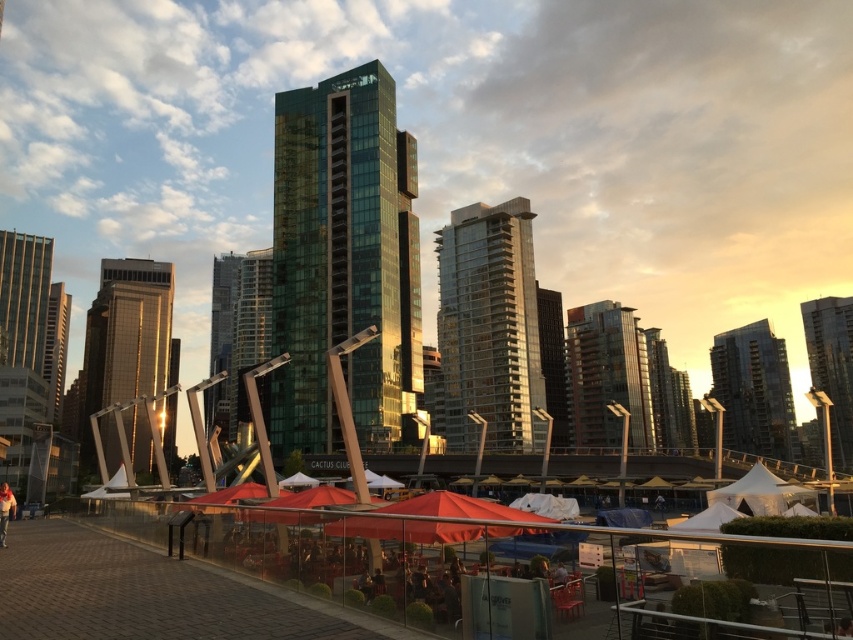
You are an architect evaluating the urban layout. You notice the brown glass building at center and the glassy reflective skyscraper at center. Which structure would cast a longer shadow during the late afternoon sun depicted in the scene?

The glassy reflective skyscraper at center is taller than the brown glass building at center, so it would cast a longer shadow during the late afternoon sun depicted in the scene.

You are standing at the plaza and want to take a photo of the brown glass building at center and the glassy reflective skyscraper at center. Which one should you focus on first if you want to capture both in a single frame without moving the camera?

You should focus on the brown glass building at center first because it is closer to you than the glassy reflective skyscraper at center, so it will be in focus while adjusting the depth of field to include the distant skyscraper.

You are standing at the plaza and want to take a photo of the brown glass building at center. If your camera can focus on objects up to 150 meters away, will it be able to capture the building clearly?

The brown glass building at center is 159.72 meters away from the viewer, which exceeds the camera focus range of 150 meters. Therefore, the camera may not capture the building clearly.